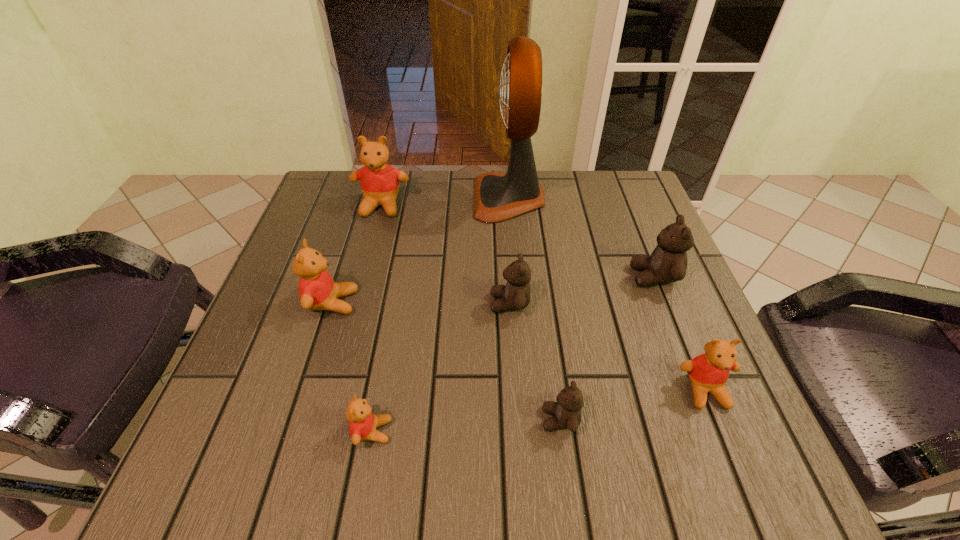
You are a GUI agent. You are given a task and a screenshot of the screen. Output one action in this format:
    pyautogui.click(x=<x>, y=<y>)
    Task: Click on the red teddy bear that stands as the fourth closest to the fan
    The image size is (960, 540).
    Given the screenshot: What is the action you would take?
    pyautogui.click(x=363, y=423)

This screenshot has height=540, width=960. Identify the location of the second closest brown teddy bear relative to the leftmost brown teddy bear. (668, 262).

Identify which brown teddy bear is located as the third nearest to the smallest red teddy bear. Please provide its 2D coordinates. Your answer should be formatted as a tuple, i.e. [(x, y)], where the tuple contains the x and y coordinates of a point satisfying the conditions above.

[(668, 262)]

The height and width of the screenshot is (540, 960). Find the location of `vacant area in the image that satisfies the following two spatial constraints: 1. on the front-facing side of the tallest object; 2. on the front-facing side of the farthest teddy bear`. vacant area in the image that satisfies the following two spatial constraints: 1. on the front-facing side of the tallest object; 2. on the front-facing side of the farthest teddy bear is located at coordinates (510, 206).

Identify the location of free spot that satisfies the following two spatial constraints: 1. on the front-facing side of the third biggest red teddy bear; 2. on the front-facing side of the smallest red teddy bear. This screenshot has height=540, width=960. (721, 431).

Where is `free spot that satisfies the following two spatial constraints: 1. on the front-facing side of the biggest red teddy bear; 2. on the front-facing side of the third nearest red teddy bear`? This screenshot has height=540, width=960. free spot that satisfies the following two spatial constraints: 1. on the front-facing side of the biggest red teddy bear; 2. on the front-facing side of the third nearest red teddy bear is located at coordinates (355, 302).